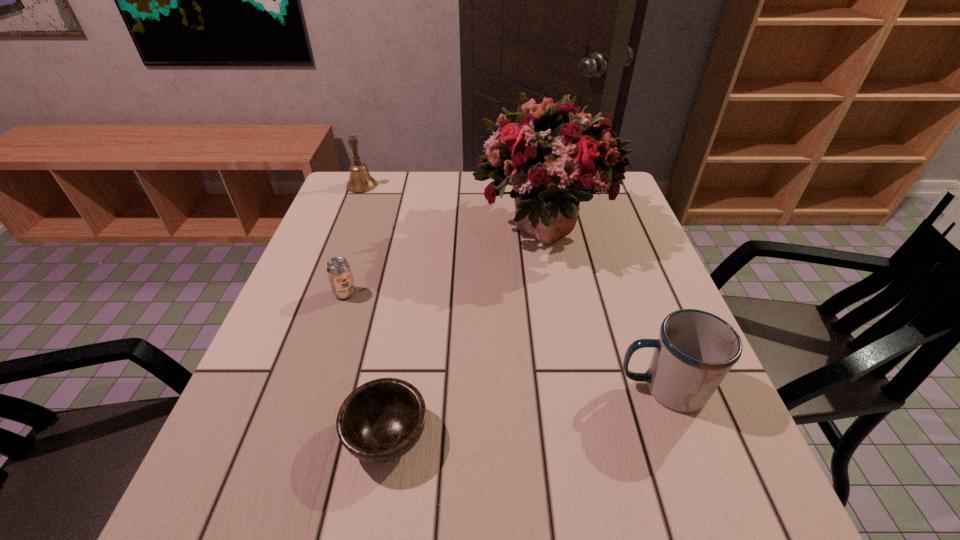
Where is `free space located 0.090m on the handle side of the mug`? The image size is (960, 540). free space located 0.090m on the handle side of the mug is located at coordinates (568, 388).

Locate an element on the screen. Image resolution: width=960 pixels, height=540 pixels. free space located on the handle side of the mug is located at coordinates (525, 388).

At what (x,y) coordinates should I click in order to perform the action: click on vacant space located 0.060m on the right of the fourth tallest object. Please return your answer as a coordinate pair (x, y). This screenshot has height=540, width=960. Looking at the image, I should click on (382, 293).

Locate an element on the screen. vacant space located on the back of the shortest object is located at coordinates (410, 301).

Identify the location of bouquet situated at the far edge. (553, 156).

In order to click on bell that is at the far edge in this screenshot , I will do `click(360, 181)`.

I want to click on object located in the near edge section of the desktop, so click(x=380, y=421).

At what (x,y) coordinates should I click in order to perform the action: click on bell present at the left edge. Please return your answer as a coordinate pair (x, y). The image size is (960, 540). Looking at the image, I should click on (360, 181).

Where is `beer can that is at the left edge`? The image size is (960, 540). beer can that is at the left edge is located at coordinates (338, 269).

Locate an element on the screen. Image resolution: width=960 pixels, height=540 pixels. bouquet present at the right edge is located at coordinates [553, 156].